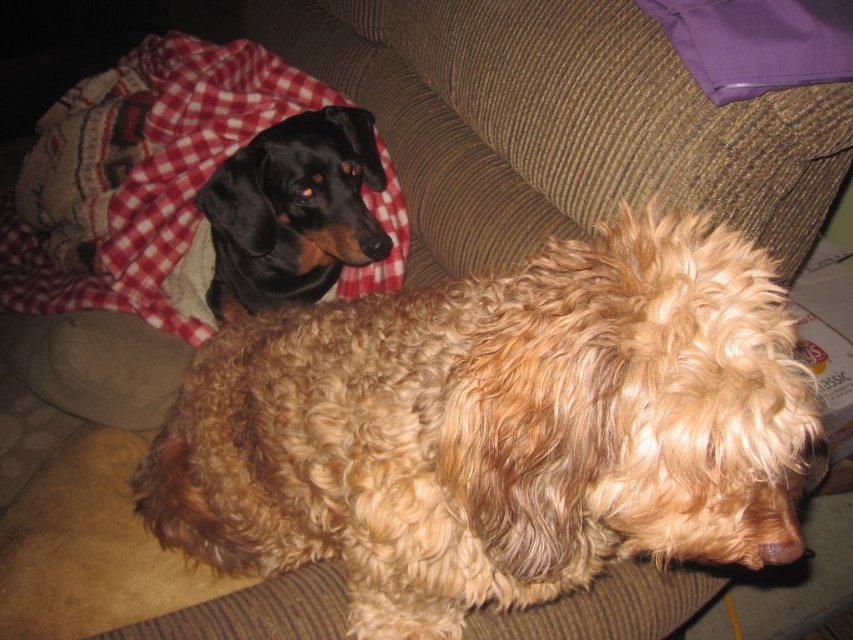
Consider the image. Between curly golden fur dog at center and red checkered blanket at upper left, which one appears on the left side from the viewer's perspective?

From the viewer's perspective, red checkered blanket at upper left appears more on the left side.

Between point (488, 502) and point (155, 257), which one is positioned in front?

Positioned in front is point (488, 502).

Does point (368, 592) come closer to viewer compared to point (106, 284)?

Yes, it is in front of point (106, 284).

Identify the location of curly golden fur dog at center. (498, 428).

Can you confirm if red checkered blanket at upper left is taller than black shiny dog at upper left?

→ Yes.

From the picture: Can you confirm if red checkered blanket at upper left is wider than black shiny dog at upper left?

Yes.

Describe the element at coordinates (164, 177) in the screenshot. The height and width of the screenshot is (640, 853). I see `red checkered blanket at upper left` at that location.

This screenshot has width=853, height=640. I want to click on red checkered blanket at upper left, so click(164, 177).

Consider the image. Is curly golden fur dog at center bigger than black shiny dog at upper left?

Yes.

Which is more to the left, curly golden fur dog at center or black shiny dog at upper left?

black shiny dog at upper left is more to the left.

Where is `curly golden fur dog at center`? The height and width of the screenshot is (640, 853). curly golden fur dog at center is located at coordinates pyautogui.click(x=498, y=428).